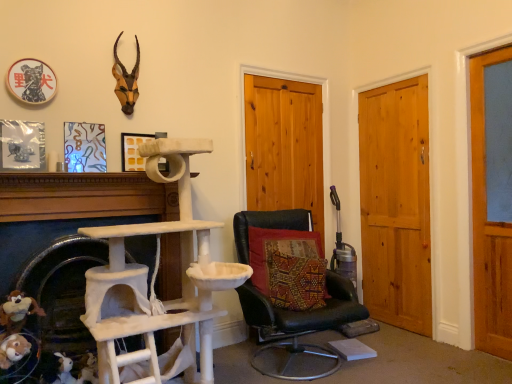
Question: Is brown plush toy at lower left, the second toy when ordered from bottom to top, in front of textured red cushion at center?

Choices:
 (A) no
 (B) yes

Answer: (B)

Question: Considering the relative sizes of brown plush toy at lower left, positioned as the second toy in back-to-front order, and textured red cushion at center in the image provided, is brown plush toy at lower left, positioned as the second toy in back-to-front order, taller than textured red cushion at center?

Choices:
 (A) yes
 (B) no

Answer: (B)

Question: Can you confirm if brown plush toy at lower left, the second toy when ordered from bottom to top, is smaller than textured red cushion at center?

Choices:
 (A) no
 (B) yes

Answer: (B)

Question: Is brown plush toy at lower left, the second toy when ordered from bottom to top, further to camera compared to textured red cushion at center?

Choices:
 (A) yes
 (B) no

Answer: (B)

Question: Considering the relative sizes of brown plush toy at lower left, arranged as the second toy when viewed from the right, and textured red cushion at center in the image provided, is brown plush toy at lower left, arranged as the second toy when viewed from the right, shorter than textured red cushion at center?

Choices:
 (A) no
 (B) yes

Answer: (B)

Question: Is textured red cushion at center surrounded by brown plush toy at lower left, arranged as the second toy when viewed from the right?

Choices:
 (A) no
 (B) yes

Answer: (A)

Question: From the image's perspective, is antlered head at upper left over wooden door at right, the first door viewed from the right?

Choices:
 (A) no
 (B) yes

Answer: (B)

Question: Does antlered head at upper left turn towards wooden door at right, placed as the third door when sorted from left to right?

Choices:
 (A) yes
 (B) no

Answer: (B)

Question: From the image's perspective, would you say antlered head at upper left is shown under wooden door at right, placed as the third door when sorted from left to right?

Choices:
 (A) yes
 (B) no

Answer: (B)

Question: Does antlered head at upper left lie behind wooden door at right, the first door viewed from the right?

Choices:
 (A) no
 (B) yes

Answer: (A)

Question: Is antlered head at upper left in contact with wooden door at right, the first door viewed from the right?

Choices:
 (A) no
 (B) yes

Answer: (A)

Question: Can you confirm if antlered head at upper left is smaller than wooden door at right, placed as the third door when sorted from left to right?

Choices:
 (A) no
 (B) yes

Answer: (B)

Question: Can you confirm if natural wood door at center right, the 2th door from the right, is taller than brown plush toy at lower left, arranged as the second toy when viewed from the right?

Choices:
 (A) yes
 (B) no

Answer: (A)